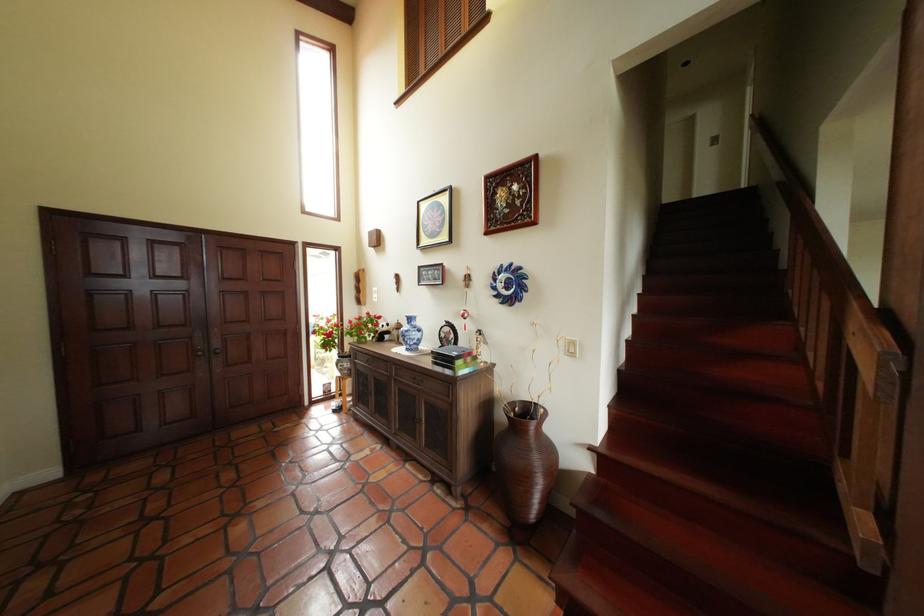
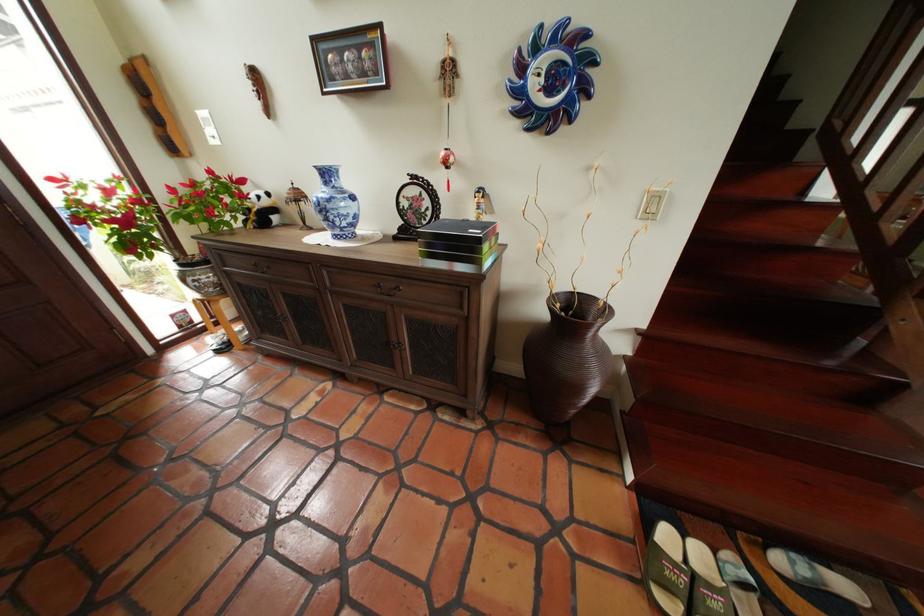
The point at (546, 405) is marked in the first image. Where is the corresponding point in the second image?

(590, 294)